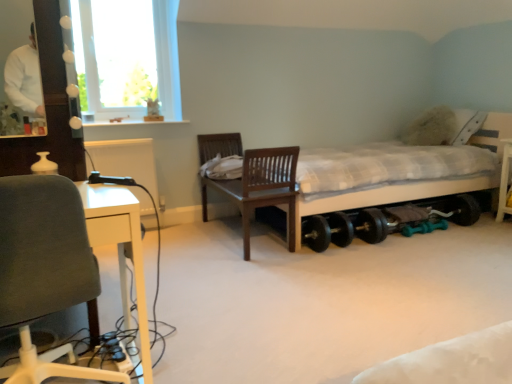
Where is `unoccupied area in front of white checkered bed at center`? The width and height of the screenshot is (512, 384). unoccupied area in front of white checkered bed at center is located at coordinates (373, 282).